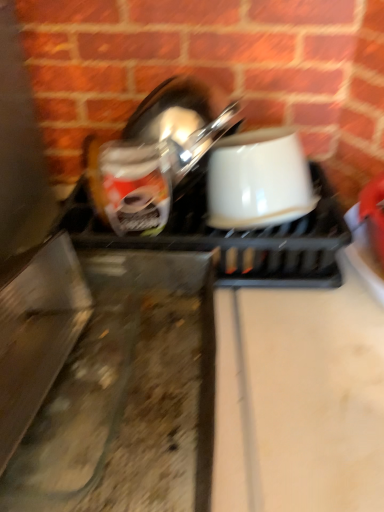
Question: Considering the positions of white glossy coffee cup at center and white glossy bowl at center in the image, is white glossy coffee cup at center wider or thinner than white glossy bowl at center?

Choices:
 (A) wide
 (B) thin

Answer: (B)

Question: Is white glossy coffee cup at center inside the boundaries of white glossy bowl at center, or outside?

Choices:
 (A) outside
 (B) inside

Answer: (B)

Question: From the image's perspective, is white glossy coffee cup at center positioned above or below white glossy bowl at center?

Choices:
 (A) below
 (B) above

Answer: (B)

Question: From the image's perspective, is white glossy bowl at center positioned above or below white glossy coffee cup at center?

Choices:
 (A) below
 (B) above

Answer: (A)

Question: Based on their sizes in the image, would you say white glossy bowl at center is bigger or smaller than white glossy coffee cup at center?

Choices:
 (A) small
 (B) big

Answer: (B)

Question: From a real-world perspective, is white glossy bowl at center positioned above or below white glossy coffee cup at center?

Choices:
 (A) below
 (B) above

Answer: (A)

Question: Looking at their shapes, would you say white glossy bowl at center is wider or thinner than white glossy coffee cup at center?

Choices:
 (A) thin
 (B) wide

Answer: (B)